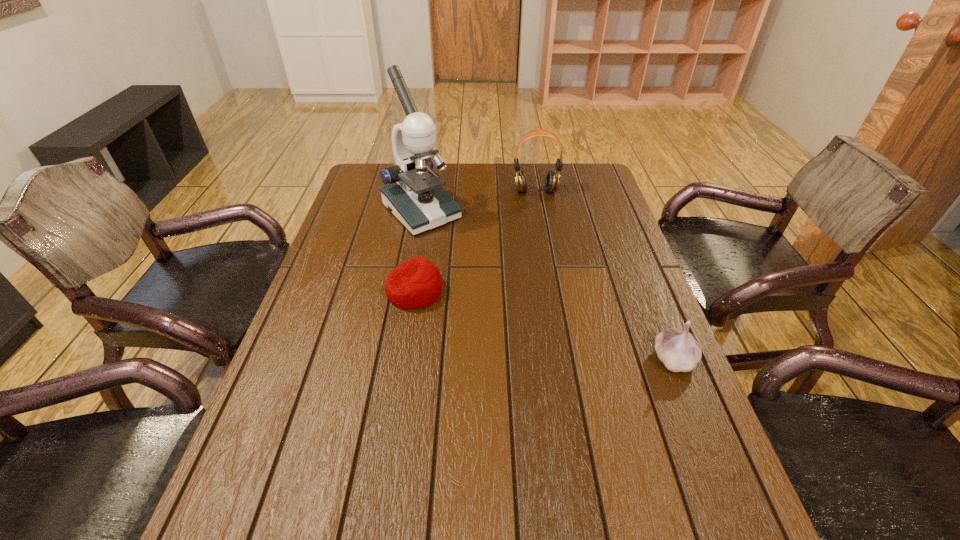
Image resolution: width=960 pixels, height=540 pixels. In the image, there is a desktop. In order to click on vacant space at the far edge in this screenshot , I will do `click(449, 168)`.

Where is `free space at the near edge`? The height and width of the screenshot is (540, 960). free space at the near edge is located at coordinates (468, 478).

The image size is (960, 540). What are the coordinates of `vacant region at the left edge of the desktop` in the screenshot? It's located at (x=372, y=238).

The image size is (960, 540). In order to click on free space at the right edge of the desktop in this screenshot , I will do `click(576, 231)`.

Where is `free location at the far left corner`? The image size is (960, 540). free location at the far left corner is located at coordinates (382, 167).

You are a GUI agent. You are given a task and a screenshot of the screen. Output one action in this format:
    pyautogui.click(x=<x>, y=<y>)
    Task: Click on the blank space at the far right corner
    
    Given the screenshot: What is the action you would take?
    pyautogui.click(x=561, y=180)

Image resolution: width=960 pixels, height=540 pixels. In order to click on vacant point located between the nearest object and the beanbag in this screenshot , I will do `click(543, 325)`.

Locate an element on the screen. unoccupied area between the headset and the beanbag is located at coordinates (475, 241).

Where is `vacant area that lies between the nearest object and the shortest object`? This screenshot has width=960, height=540. vacant area that lies between the nearest object and the shortest object is located at coordinates (543, 325).

Find the location of a particular element. The height and width of the screenshot is (540, 960). vacant point located between the beanbag and the headset is located at coordinates (475, 241).